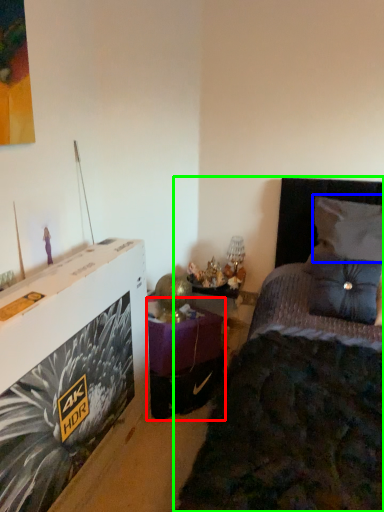
Question: Which object is the closest to the table (highlighted by a red box)? Choose among these: pillow (highlighted by a blue box) or bed (highlighted by a green box).

Choices:
 (A) pillow
 (B) bed

Answer: (B)